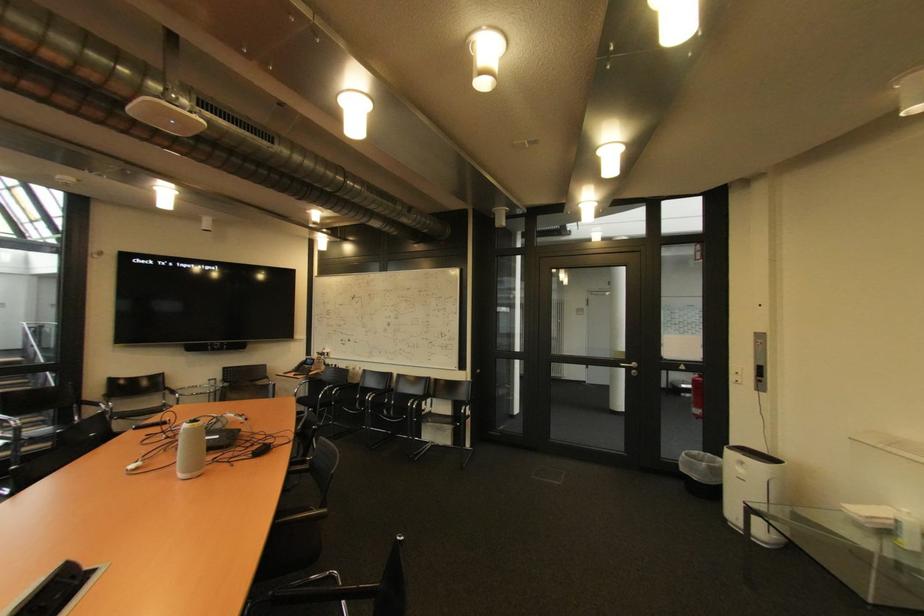
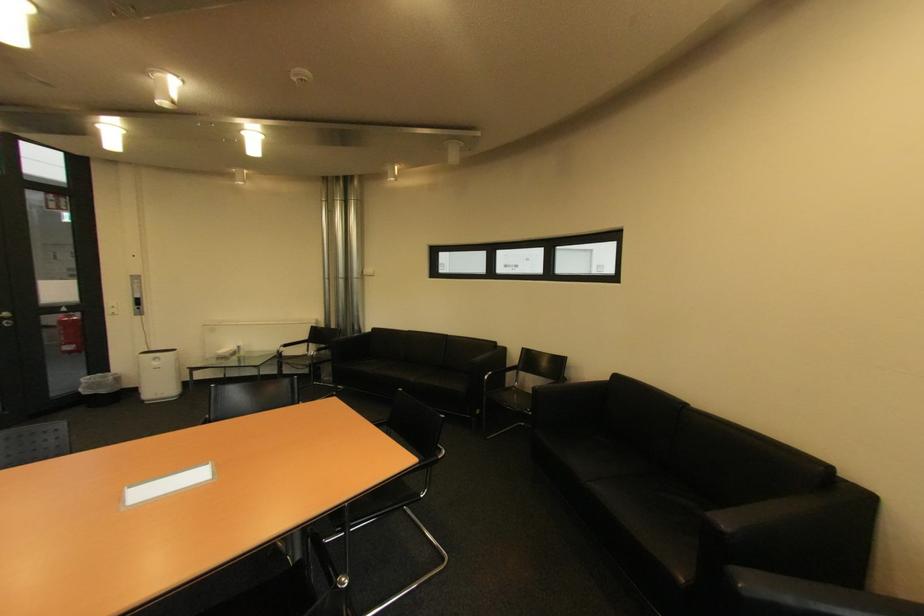
Where in the second image is the point corresponding to pixel 690 471 from the first image?

(94, 394)